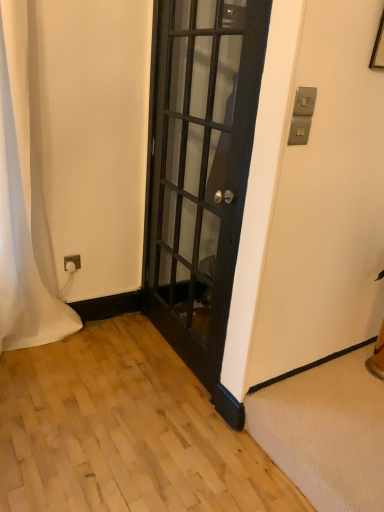
Locate an element on the screen. This screenshot has height=512, width=384. white fabric curtain at left is located at coordinates (21, 203).

The height and width of the screenshot is (512, 384). Describe the element at coordinates (21, 203) in the screenshot. I see `white fabric curtain at left` at that location.

Where is `black glass door at center`? black glass door at center is located at coordinates (201, 169).

The image size is (384, 512). What do you see at coordinates (201, 169) in the screenshot? I see `black glass door at center` at bounding box center [201, 169].

Where is `white fabric curtain at left`? This screenshot has height=512, width=384. white fabric curtain at left is located at coordinates (21, 203).

Which is more to the left, white fabric curtain at left or black glass door at center?

Positioned to the left is white fabric curtain at left.

Relative to black glass door at center, is white fabric curtain at left in front or behind?

In the image, white fabric curtain at left appears behind black glass door at center.

Is point (7, 206) farther from viewer compared to point (244, 100)?

Yes, it is.

From the image's perspective, is white fabric curtain at left above black glass door at center?

Yes, from the image's perspective, white fabric curtain at left is above black glass door at center.

From a real-world perspective, which is physically below, white fabric curtain at left or black glass door at center?

white fabric curtain at left, from a real-world perspective.

Considering the sizes of objects white fabric curtain at left and black glass door at center in the image provided, who is wider, white fabric curtain at left or black glass door at center?

white fabric curtain at left is wider.

Considering the sizes of objects white fabric curtain at left and black glass door at center in the image provided, who is taller, white fabric curtain at left or black glass door at center?

With more height is black glass door at center.

Does white fabric curtain at left have a larger size compared to black glass door at center?

No.

Is white fabric curtain at left not within black glass door at center?

white fabric curtain at left lies outside black glass door at center's area.

Is white fabric curtain at left positioned far away from black glass door at center?

white fabric curtain at left is actually quite close to black glass door at center.

Could you tell me if white fabric curtain at left is turned towards black glass door at center?

No, white fabric curtain at left is not aimed at black glass door at center.

How much distance is there between white fabric curtain at left and black glass door at center?

They are 30.07 inches apart.

Find the location of a particular element. Image resolution: width=384 pixels, height=512 pixels. curtain that is on the left side of black glass door at center is located at coordinates (21, 203).

Between black glass door at center and white fabric curtain at left, which one appears on the left side from the viewer's perspective?

white fabric curtain at left.

Relative to white fabric curtain at left, is black glass door at center in front or behind?

black glass door at center is positioned closer to the viewer than white fabric curtain at left.

Which is closer, (260, 59) or (9, 86)?

The point (260, 59) is closer.

Consider the image. From the image's perspective, would you say black glass door at center is positioned over white fabric curtain at left?

No.

From a real-world perspective, is black glass door at center located beneath white fabric curtain at left?

No, from a real-world perspective, black glass door at center is not under white fabric curtain at left.

Can you confirm if black glass door at center is wider than white fabric curtain at left?

Incorrect, the width of black glass door at center does not surpass that of white fabric curtain at left.

Considering the sizes of objects black glass door at center and white fabric curtain at left in the image provided, who is taller, black glass door at center or white fabric curtain at left?

Standing taller between the two is black glass door at center.

Considering the relative sizes of black glass door at center and white fabric curtain at left in the image provided, is black glass door at center bigger than white fabric curtain at left?

Correct, black glass door at center is larger in size than white fabric curtain at left.

Is black glass door at center inside the boundaries of white fabric curtain at left, or outside?

black glass door at center is located beyond the bounds of white fabric curtain at left.

Can you see black glass door at center touching white fabric curtain at left?

No, black glass door at center is not making contact with white fabric curtain at left.

Is white fabric curtain at left at the back of black glass door at center?

That's not correct — black glass door at center is not looking away from white fabric curtain at left.

Measure the distance between black glass door at center and white fabric curtain at left.

black glass door at center is 30.07 inches away from white fabric curtain at left.

I want to click on curtain on the left of black glass door at center, so click(21, 203).

The height and width of the screenshot is (512, 384). I want to click on door located below the white fabric curtain at left (from the image's perspective), so click(x=201, y=169).

I want to click on door above the white fabric curtain at left (from a real-world perspective), so click(201, 169).